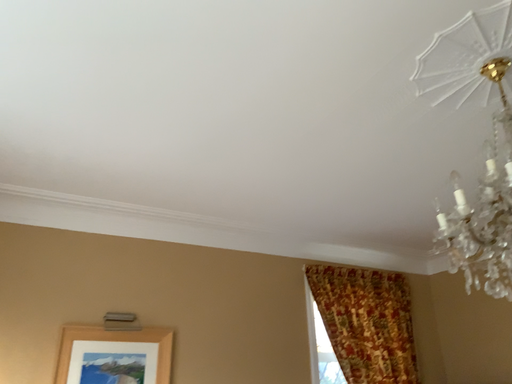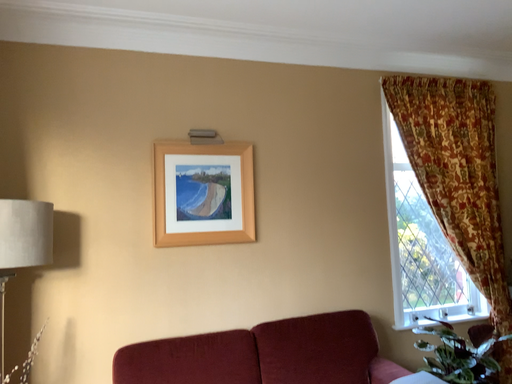
Question: How did the camera likely rotate when shooting the video?

Choices:
 (A) rotated upward
 (B) rotated downward

Answer: (B)